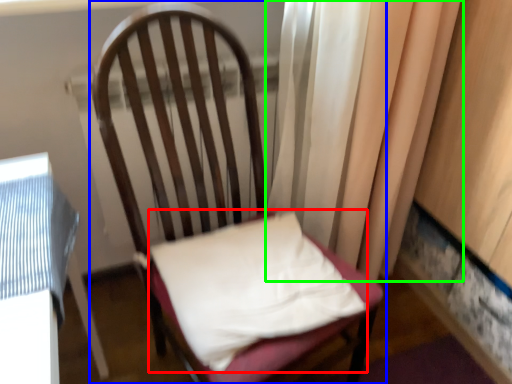
Question: Based on their relative distances, which object is nearer to pillow (highlighted by a red box)? Choose from chair (highlighted by a blue box) and curtain (highlighted by a green box).

Choices:
 (A) chair
 (B) curtain

Answer: (A)